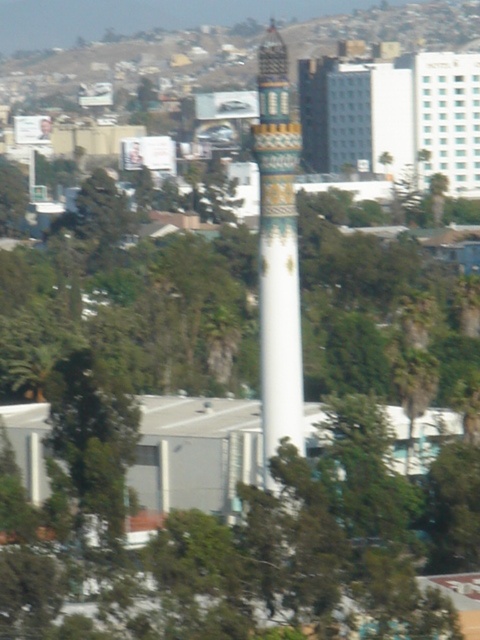
You are an architect analyzing the image. You need to determine if the gold mosaic minaret at center can be seen from the green leafy tree at lower left without any obstruction. Based on their sizes, can you infer anything about their visibility?

The gold mosaic minaret at center is larger in size than the green leafy tree at lower left, which suggests that the minaret is taller and more prominent, so it is likely visible from the tree without obstruction.

You are a photographer positioned in the park area. You want to capture a clear photo of the gold mosaic minaret at center without any obstructions. Is the green leafy tree at lower left blocking your view of the minaret?

The green leafy tree at lower left is behind the gold mosaic minaret at center, so it will not block your view of the minaret as it is positioned behind the structure.

You are a drone operator trying to capture a photo of the gold mosaic minaret at center and the green leafy tree at lower left. From your current position, which object would appear closer to the top of the photo?

The gold mosaic minaret at center is located above the green leafy tree at lower left, so it would appear closer to the top of the photo.